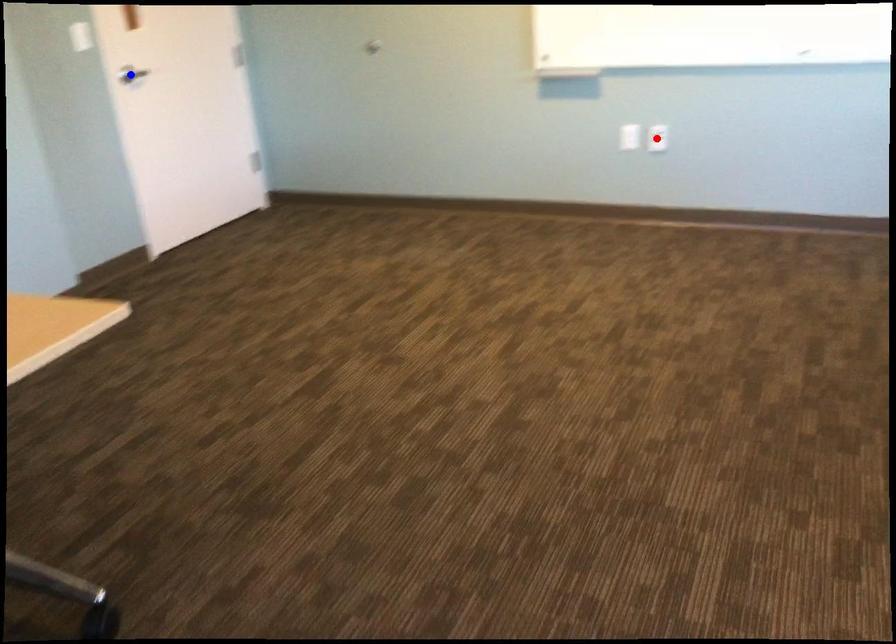
Question: In the image, two points are highlighted. Which point is nearer to the camera? Reply with the corresponding letter.

Choices:
 (A) blue point
 (B) red point

Answer: (B)